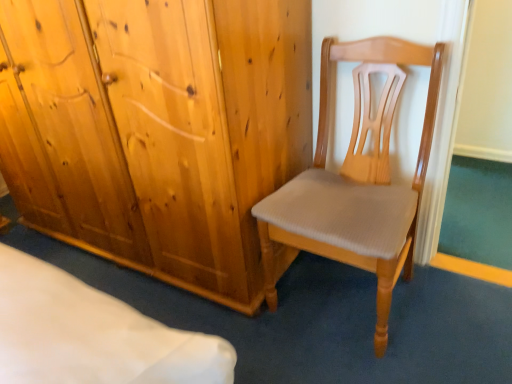
Question: Does point (251, 4) appear closer or farther from the camera than point (438, 59)?

Choices:
 (A) closer
 (B) farther

Answer: (A)

Question: Looking at their shapes, would you say natural wood wardrobe at center is wider or thinner than light brown wood chair at center?

Choices:
 (A) thin
 (B) wide

Answer: (B)

Question: Is natural wood wardrobe at center in front of or behind light brown wood chair at center in the image?

Choices:
 (A) front
 (B) behind

Answer: (B)

Question: Based on their sizes in the image, would you say light brown wood chair at center is bigger or smaller than natural wood wardrobe at center?

Choices:
 (A) big
 (B) small

Answer: (B)

Question: In terms of height, does light brown wood chair at center look taller or shorter compared to natural wood wardrobe at center?

Choices:
 (A) tall
 (B) short

Answer: (B)

Question: Is point (398, 273) closer or farther from the camera than point (96, 160)?

Choices:
 (A) farther
 (B) closer

Answer: (B)

Question: From a real-world perspective, is light brown wood chair at center physically located above or below natural wood wardrobe at center?

Choices:
 (A) above
 (B) below

Answer: (B)